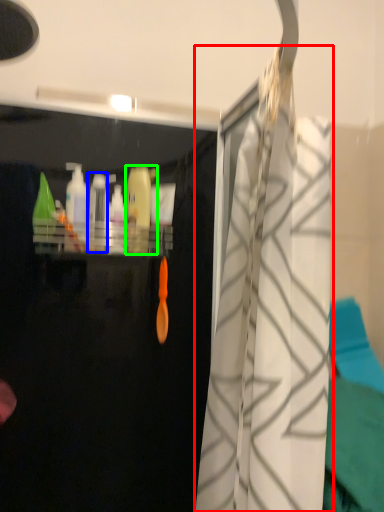
Question: Which object is the farthest from curtain (highlighted by a red box)? Choose among these: bottle (highlighted by a blue box) or cleaning product (highlighted by a green box).

Choices:
 (A) bottle
 (B) cleaning product

Answer: (A)